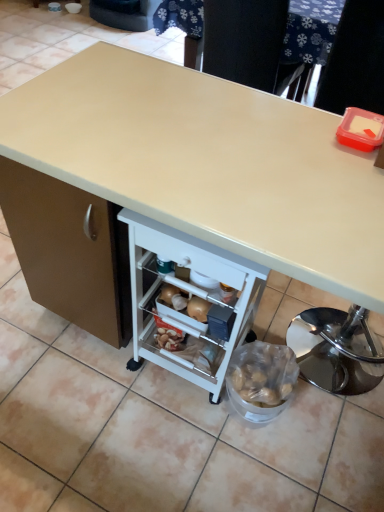
Question: Is beige laminate desk at center inside or outside of beige laminate table at upper center?

Choices:
 (A) inside
 (B) outside

Answer: (B)

Question: Considering the positions of beige laminate desk at center and beige laminate table at upper center in the image, is beige laminate desk at center taller or shorter than beige laminate table at upper center?

Choices:
 (A) tall
 (B) short

Answer: (A)

Question: Considering the relative positions of beige laminate desk at center and beige laminate table at upper center in the image provided, is beige laminate desk at center to the left or to the right of beige laminate table at upper center?

Choices:
 (A) left
 (B) right

Answer: (A)

Question: Is beige laminate table at upper center inside the boundaries of beige laminate desk at center, or outside?

Choices:
 (A) inside
 (B) outside

Answer: (B)

Question: Is point (319, 41) positioned closer to the camera than point (180, 196)?

Choices:
 (A) farther
 (B) closer

Answer: (A)

Question: In terms of width, does beige laminate table at upper center look wider or thinner when compared to beige laminate desk at center?

Choices:
 (A) thin
 (B) wide

Answer: (A)

Question: Is beige laminate table at upper center bigger or smaller than beige laminate desk at center?

Choices:
 (A) big
 (B) small

Answer: (B)